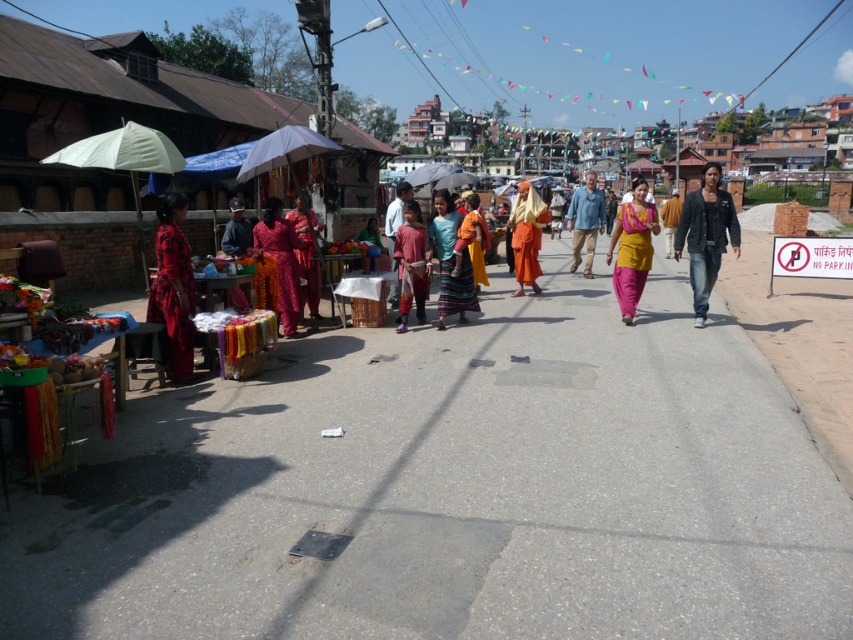
Question: Among these points, which one is nearest to the camera?

Choices:
 (A) (517, 278)
 (B) (721, 236)
 (C) (158, 248)
 (D) (436, 188)

Answer: (C)

Question: From the image, what is the correct spatial relationship of matte red dress at left in relation to matte pink dress at center?

Choices:
 (A) left
 (B) right

Answer: (A)

Question: Which is nearer to the multicolored woven skirt at center?

Choices:
 (A) orange clothed monk at center
 (B) yellow cotton saree at center
 (C) white matte umbrella at center

Answer: (C)

Question: Is matte red dress at left to the left of white matte umbrella at center from the viewer's perspective?

Choices:
 (A) no
 (B) yes

Answer: (B)

Question: Which object is farther from the camera taking this photo?

Choices:
 (A) matte pink dress at center
 (B) matte orange dress at center
 (C) white matte umbrella at center

Answer: (A)

Question: Can you confirm if matte red dress at left is smaller than dark blue denim jeans at right?

Choices:
 (A) yes
 (B) no

Answer: (A)